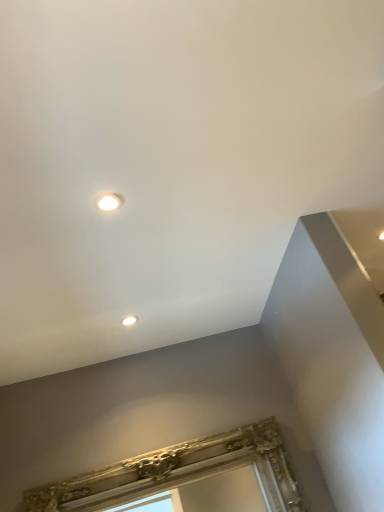
Question: Considering the relative positions of matte white droplight at upper center, which is the second droplight from bottom to top, and gold ornate frame at lower center in the image provided, is matte white droplight at upper center, which is the second droplight from bottom to top, to the left or to the right of gold ornate frame at lower center?

Choices:
 (A) left
 (B) right

Answer: (A)

Question: Is matte white droplight at upper center, acting as the first droplight starting from the front, bigger or smaller than gold ornate frame at lower center?

Choices:
 (A) small
 (B) big

Answer: (A)

Question: Which object is positioned closest to the matte white droplight at upper center, which is the second droplight from bottom to top?

Choices:
 (A) matte white droplight at upper center, acting as the 1th droplight starting from the back
 (B) gold ornate frame at lower center

Answer: (A)

Question: Which of these objects is positioned closest to the gold ornate frame at lower center?

Choices:
 (A) matte white droplight at upper center, acting as the first droplight starting from the front
 (B) matte white droplight at upper center, the second droplight from the front

Answer: (B)